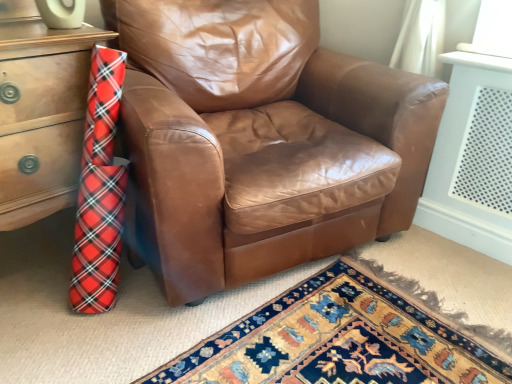
Question: From a real-world perspective, is wooden chest of drawers at left physically located above or below brown leather chair at center?

Choices:
 (A) above
 (B) below

Answer: (B)

Question: From the image's perspective, is wooden chest of drawers at left located above or below brown leather chair at center?

Choices:
 (A) below
 (B) above

Answer: (A)

Question: Is point (40, 140) positioned closer to the camera than point (278, 36)?

Choices:
 (A) farther
 (B) closer

Answer: (B)

Question: Is brown leather chair at center bigger or smaller than wooden chest of drawers at left?

Choices:
 (A) big
 (B) small

Answer: (A)

Question: Would you say brown leather chair at center is inside or outside wooden chest of drawers at left?

Choices:
 (A) inside
 (B) outside

Answer: (B)

Question: From a real-world perspective, is brown leather chair at center positioned above or below wooden chest of drawers at left?

Choices:
 (A) below
 (B) above

Answer: (B)

Question: Considering the positions of brown leather chair at center and wooden chest of drawers at left in the image, is brown leather chair at center wider or thinner than wooden chest of drawers at left?

Choices:
 (A) wide
 (B) thin

Answer: (A)